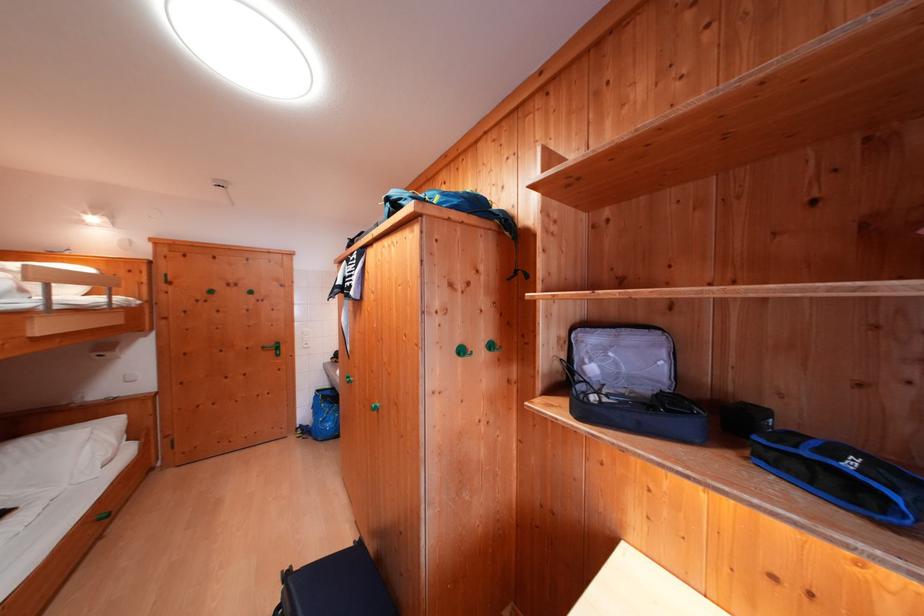
Find where to grasp the bunk bed guard rail. Please return your answer as a coordinate pair (x, y).

(81, 490)